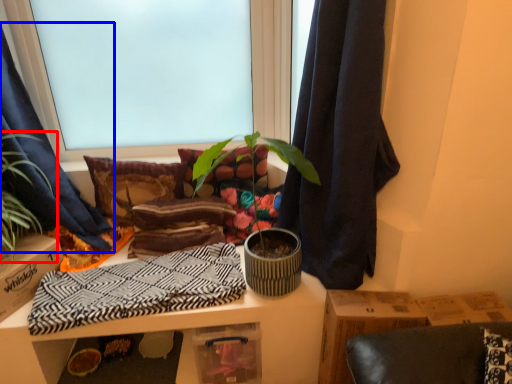
Question: Which point is closer to the camera, houseplant (highlighted by a red box) or curtain (highlighted by a blue box)?

Choices:
 (A) houseplant
 (B) curtain

Answer: (B)